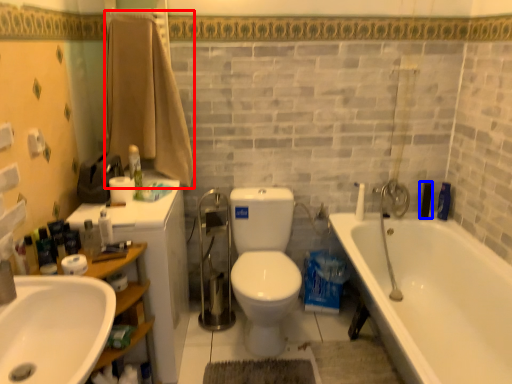
Question: Which of the following is the closest to the observer, bath towel (highlighted by a red box) or toiletry (highlighted by a blue box)?

Choices:
 (A) bath towel
 (B) toiletry

Answer: (A)